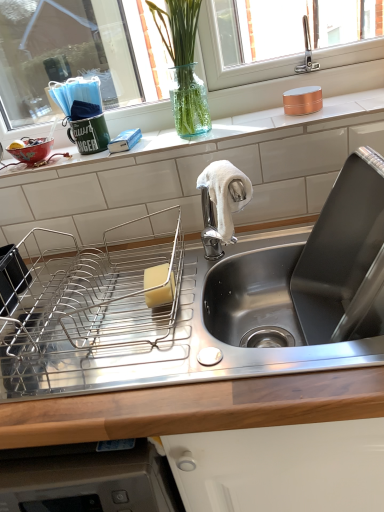
Question: Should I look upward or downward to see copper metallic canister at upper right, positioned as the 1th appliance in right-to-left order?

Choices:
 (A) up
 (B) down

Answer: (A)

Question: Does metallic wire dish rack at center-left, the second appliance when ordered from right to left, appear on the right side of clear glass vase at upper center?

Choices:
 (A) yes
 (B) no

Answer: (B)

Question: Considering the relative sizes of metallic wire dish rack at center-left, the second appliance when ordered from right to left, and clear glass vase at upper center in the image provided, is metallic wire dish rack at center-left, the second appliance when ordered from right to left, shorter than clear glass vase at upper center?

Choices:
 (A) yes
 (B) no

Answer: (A)

Question: From a real-world perspective, is metallic wire dish rack at center-left, acting as the 1th appliance starting from the bottom, over clear glass vase at upper center?

Choices:
 (A) no
 (B) yes

Answer: (A)

Question: Is metallic wire dish rack at center-left, acting as the first appliance starting from the left, further to the viewer compared to clear glass vase at upper center?

Choices:
 (A) yes
 (B) no

Answer: (B)

Question: Is metallic wire dish rack at center-left, the second appliance in the top-to-bottom sequence, facing away from clear glass vase at upper center?

Choices:
 (A) yes
 (B) no

Answer: (B)

Question: Is metallic wire dish rack at center-left, acting as the first appliance starting from the left, taller than clear glass vase at upper center?

Choices:
 (A) yes
 (B) no

Answer: (B)

Question: From a real-world perspective, is clear glass vase at upper center located higher than white tile at upper center?

Choices:
 (A) yes
 (B) no

Answer: (A)

Question: From the image's perspective, is clear glass vase at upper center above white tile at upper center?

Choices:
 (A) no
 (B) yes

Answer: (B)

Question: Is clear glass vase at upper center oriented towards white tile at upper center?

Choices:
 (A) no
 (B) yes

Answer: (B)

Question: Does clear glass vase at upper center have a larger size compared to white tile at upper center?

Choices:
 (A) yes
 (B) no

Answer: (A)

Question: Can you confirm if clear glass vase at upper center is smaller than white tile at upper center?

Choices:
 (A) yes
 (B) no

Answer: (B)

Question: Considering the relative sizes of clear glass vase at upper center and white tile at upper center in the image provided, is clear glass vase at upper center shorter than white tile at upper center?

Choices:
 (A) no
 (B) yes

Answer: (A)

Question: Can you confirm if matte ceramic bowl at left is shorter than stainless steel sink at upper right?

Choices:
 (A) no
 (B) yes

Answer: (B)